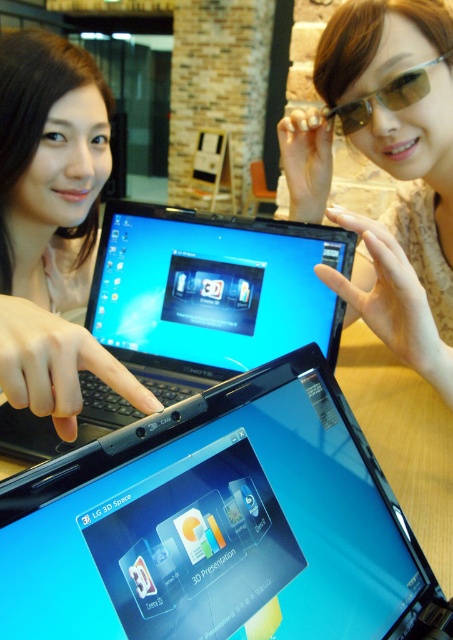
Between point (134, 609) and point (101, 308), which one is positioned in front?

Positioned in front is point (134, 609).

Is point (112, 531) farther from camera compared to point (263, 353)?

No.

Locate an element on the screen. The width and height of the screenshot is (453, 640). satin black laptop at center is located at coordinates (218, 525).

Between sunglasses at upper center and matte black laptop at left, which one appears on the left side from the viewer's perspective?

matte black laptop at left

Is sunglasses at upper center above matte black laptop at left?

No, sunglasses at upper center is not above matte black laptop at left.

The width and height of the screenshot is (453, 640). Identify the location of sunglasses at upper center. (386, 170).

Is satin black laptop at center thinner than sunglasses at upper center?

Yes, satin black laptop at center is thinner than sunglasses at upper center.

Which is more to the right, satin black laptop at center or sunglasses at upper center?

Positioned to the right is sunglasses at upper center.

Does point (366, 516) come closer to viewer compared to point (411, 236)?

Yes, it is in front of point (411, 236).

What are the coordinates of `satin black laptop at center` in the screenshot? It's located at (218, 525).